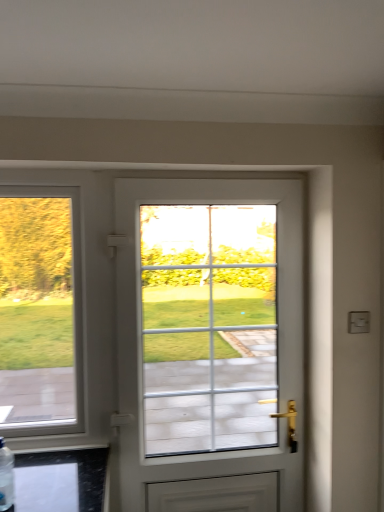
This screenshot has width=384, height=512. I want to click on clear plastic bottle at lower left, so click(6, 477).

The height and width of the screenshot is (512, 384). What do you see at coordinates (6, 477) in the screenshot?
I see `clear plastic bottle at lower left` at bounding box center [6, 477].

What do you see at coordinates (210, 344) in the screenshot? The width and height of the screenshot is (384, 512). I see `white glossy door at center` at bounding box center [210, 344].

In order to click on white glossy door at center in this screenshot , I will do `click(210, 344)`.

Measure the distance between point (238, 403) and camera.

The depth of point (238, 403) is 1.86 meters.

What are the coordinates of `clear plastic bottle at lower left` in the screenshot? It's located at (6, 477).

Considering the relative positions of white glossy door at center and clear plastic bottle at lower left in the image provided, is white glossy door at center to the left or to the right of clear plastic bottle at lower left?

white glossy door at center is to the right of clear plastic bottle at lower left.

Considering their positions, is white glossy door at center located in front of or behind clear plastic bottle at lower left?

Visually, white glossy door at center is located behind clear plastic bottle at lower left.

Is point (121, 481) closer or farther from the camera than point (11, 475)?

Point (121, 481).

From the image's perspective, relative to clear plastic bottle at lower left, is white glossy door at center above or below?

Clearly, from the image's perspective, white glossy door at center is above clear plastic bottle at lower left.

From a real-world perspective, is white glossy door at center physically below clear plastic bottle at lower left?

No, from a real-world perspective, white glossy door at center is not beneath clear plastic bottle at lower left.

Looking at their sizes, would you say white glossy door at center is wider or thinner than clear plastic bottle at lower left?

white glossy door at center is wider than clear plastic bottle at lower left.

Who is shorter, white glossy door at center or clear plastic bottle at lower left?

clear plastic bottle at lower left is shorter.

Considering the relative sizes of white glossy door at center and clear plastic bottle at lower left in the image provided, is white glossy door at center bigger than clear plastic bottle at lower left?

Indeed, white glossy door at center has a larger size compared to clear plastic bottle at lower left.

Can we say white glossy door at center lies outside clear plastic bottle at lower left?

That's correct, white glossy door at center is outside of clear plastic bottle at lower left.

Is white glossy door at center next to clear plastic bottle at lower left?

No.

Based on the photo, is white glossy door at center positioned with its back to clear plastic bottle at lower left?

white glossy door at center does not have its back to clear plastic bottle at lower left.

How far apart are white glossy door at center and clear plastic bottle at lower left?

The distance of white glossy door at center from clear plastic bottle at lower left is 35.48 inches.

Locate an element on the screen. This screenshot has height=512, width=384. bottle that appears in front of the white glossy door at center is located at coordinates (6, 477).

Between clear plastic bottle at lower left and white glossy door at center, which one appears on the right side from the viewer's perspective?

From the viewer's perspective, white glossy door at center appears more on the right side.

Which object is closer to the camera, clear plastic bottle at lower left or white glossy door at center?

clear plastic bottle at lower left.

Which is closer to the camera, (13, 495) or (259, 192)?

Point (13, 495)

From the image's perspective, which object appears higher, clear plastic bottle at lower left or white glossy door at center?

white glossy door at center, from the image's perspective.

From a real-world perspective, is clear plastic bottle at lower left physically located above or below white glossy door at center?

Clearly, from a real-world perspective, clear plastic bottle at lower left is below white glossy door at center.

Considering the relative sizes of clear plastic bottle at lower left and white glossy door at center in the image provided, is clear plastic bottle at lower left thinner than white glossy door at center?

Yes.

In the scene shown: In terms of height, does clear plastic bottle at lower left look taller or shorter compared to white glossy door at center?

Clearly, clear plastic bottle at lower left is shorter compared to white glossy door at center.

Which of these two, clear plastic bottle at lower left or white glossy door at center, is smaller?

clear plastic bottle at lower left is smaller.

Is white glossy door at center located within clear plastic bottle at lower left?

No, white glossy door at center is not inside clear plastic bottle at lower left.

From the picture: Is clear plastic bottle at lower left positioned far away from white glossy door at center?

No, there isn't a large distance between clear plastic bottle at lower left and white glossy door at center.

Is clear plastic bottle at lower left positioned with its back to white glossy door at center?

clear plastic bottle at lower left does not have its back to white glossy door at center.

You are a GUI agent. You are given a task and a screenshot of the screen. Output one action in this format:
    pyautogui.click(x=<x>, y=<y>)
    Task: Click on the door located on the right of clear plastic bottle at lower left
    
    Given the screenshot: What is the action you would take?
    pyautogui.click(x=210, y=344)

Where is `bottle below the white glossy door at center (from a real-world perspective)`? bottle below the white glossy door at center (from a real-world perspective) is located at coordinates (6, 477).

Locate an element on the screen. bottle that is on the left side of white glossy door at center is located at coordinates (6, 477).